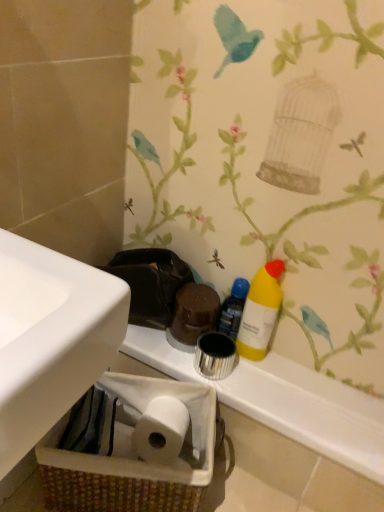
Locate an element on the screen. free spot in front of yellow matte bottle at right is located at coordinates (259, 385).